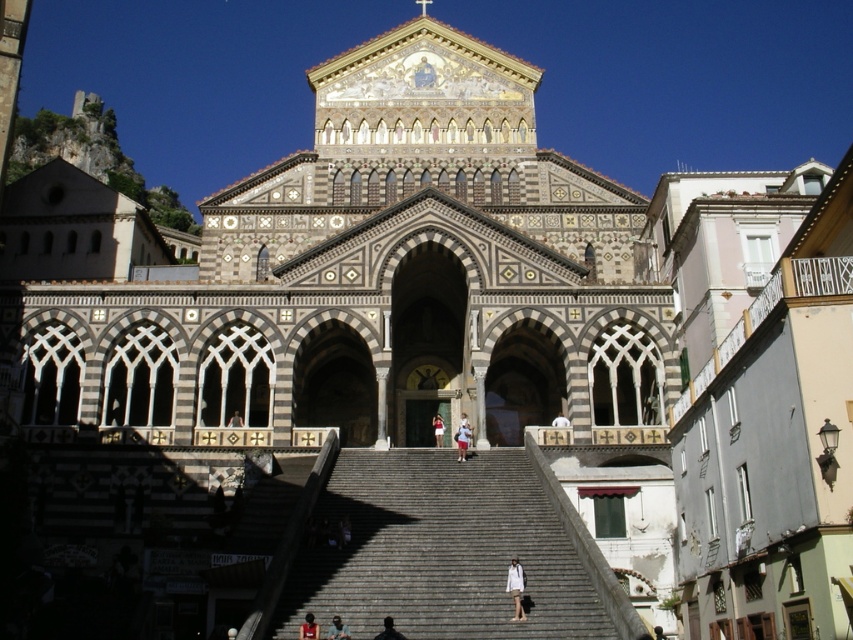
Which of these two, white cotton shirt at center or dark brown hair at center, stands taller?

Standing taller between the two is white cotton shirt at center.

Which of these two, white cotton shirt at center or dark brown hair at center, stands shorter?

dark brown hair at center

At what (x,y) coordinates should I click in order to perform the action: click on white cotton shirt at center. Please return your answer as a coordinate pair (x, y). Image resolution: width=853 pixels, height=640 pixels. Looking at the image, I should click on (462, 438).

Does dark brown leather jacket at center have a greater height compared to dark blue fabric at center?

Yes.

Who is more forward, (306, 632) or (335, 616)?

Point (306, 632) is in front.

Is point (310, 616) more distant than point (339, 620)?

No.

Where is `dark brown leather jacket at center`? The width and height of the screenshot is (853, 640). dark brown leather jacket at center is located at coordinates (308, 627).

Is dark brown leather jacket at center wider than white cotton dress at center?

Yes.

Which is in front, point (314, 625) or point (444, 422)?

Point (314, 625) is more forward.

The width and height of the screenshot is (853, 640). Find the location of `dark brown leather jacket at center`. dark brown leather jacket at center is located at coordinates (308, 627).

Where is `dark brown leather jacket at center`? dark brown leather jacket at center is located at coordinates (308, 627).